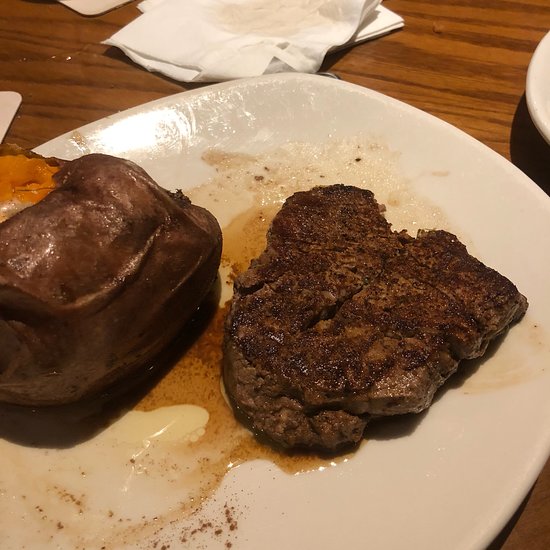
Locate an element on the screen. This screenshot has width=550, height=550. table is located at coordinates (525, 534).